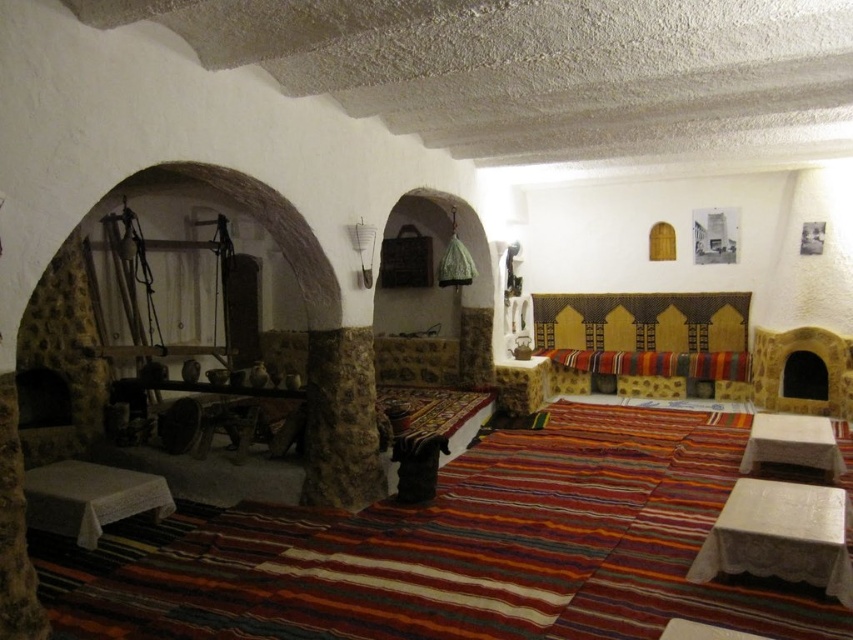
You are standing in the room and want to move from the point at coordinates point (503, 433) to the point at coordinates point (49, 481). Can you walk directly between them without any obstacles?

Point point (503, 433) is behind point point (49, 481), so there might be an obstacle blocking the path between them. You cannot walk directly between them without any obstacles.